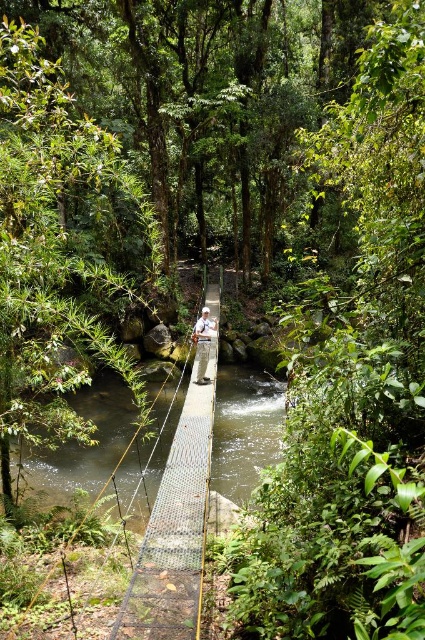
You are a hiker standing on the suspension bridge and notice the clear water at bridge center and the white fabric shirt at center. Which object takes up more space in the scene?

The clear water at bridge center is larger in size than the white fabric shirt at center, so the clear water at bridge center takes up more space in the scene.

You are a hiker standing on the suspension bridge. You want to drink water from the stream below without leaving the bridge. Considering the distance between the clear water at bridge center and your white fabric shirt at center, can you safely reach the water with a 3.5 meter long pole?

The distance between the clear water at bridge center and the white fabric shirt at center is 4.04 meters. Since the pole is only 3.5 meters long, it is not long enough to safely reach the water from the bridge.

You are a hiker standing on the suspension bridge and want to know if the clear water at bridge center is higher or lower than your white fabric shirt at center. According to the scene, what can you observe?

The clear water at bridge center is taller than the white fabric shirt at center, meaning the water is higher than the shirt.